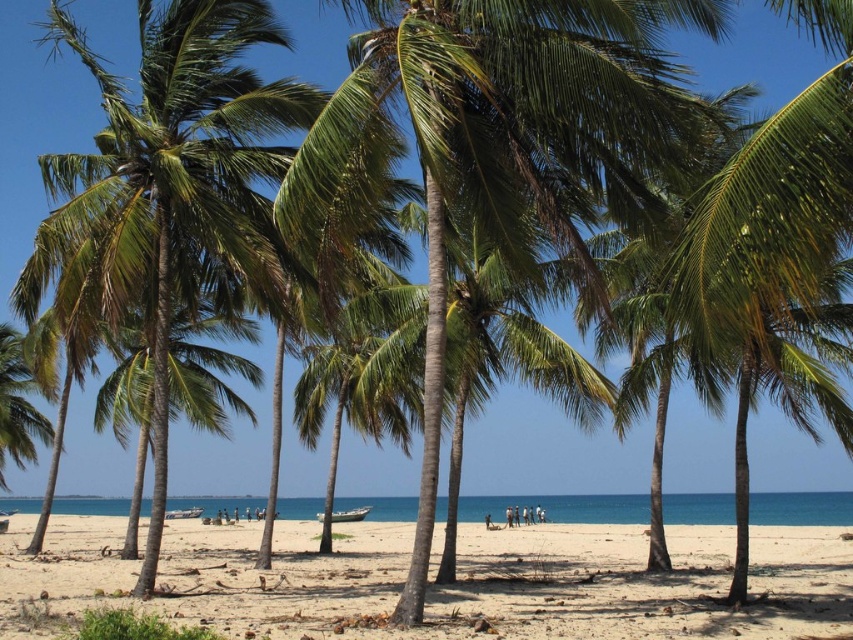
Question: Which of the following is the farthest from the observer?

Choices:
 (A) (722, 612)
 (B) (264, 272)

Answer: (A)

Question: Is light beige sand at center below green leafy palm tree at left?

Choices:
 (A) no
 (B) yes

Answer: (B)

Question: Can you confirm if light beige sand at center is wider than green leafy palm tree at left?

Choices:
 (A) yes
 (B) no

Answer: (A)

Question: Among these points, which one is farthest from the camera?

Choices:
 (A) (186, 44)
 (B) (787, 540)

Answer: (B)

Question: Does light beige sand at center have a smaller size compared to green leafy palm tree at left?

Choices:
 (A) yes
 (B) no

Answer: (A)